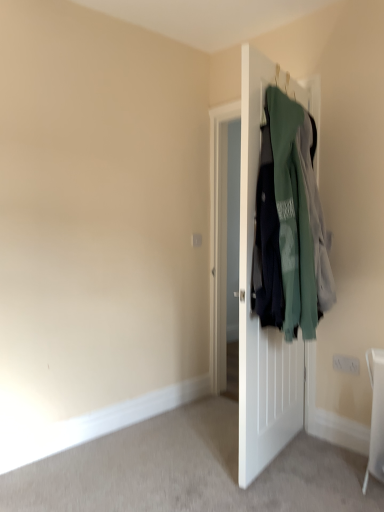
Question: Considering the relative positions of green fabric jackets at right and white matte door at center in the image provided, is green fabric jackets at right in front of white matte door at center?

Choices:
 (A) yes
 (B) no

Answer: (A)

Question: Is green fabric jackets at right facing away from white matte door at center?

Choices:
 (A) no
 (B) yes

Answer: (B)

Question: Does green fabric jackets at right have a lesser height compared to white matte door at center?

Choices:
 (A) no
 (B) yes

Answer: (B)

Question: Does green fabric jackets at right turn towards white matte door at center?

Choices:
 (A) no
 (B) yes

Answer: (B)

Question: Does green fabric jackets at right have a smaller size compared to white matte door at center?

Choices:
 (A) yes
 (B) no

Answer: (B)

Question: Is white matte door at center inside green fabric jackets at right?

Choices:
 (A) no
 (B) yes

Answer: (B)

Question: From a real-world perspective, is white matte door at center located higher than green fabric jackets at right?

Choices:
 (A) no
 (B) yes

Answer: (A)

Question: Are white matte door at center and green fabric jackets at right making contact?

Choices:
 (A) no
 (B) yes

Answer: (A)

Question: Would you consider white matte door at center to be distant from green fabric jackets at right?

Choices:
 (A) yes
 (B) no

Answer: (B)

Question: Does white matte door at center have a smaller size compared to green fabric jackets at right?

Choices:
 (A) no
 (B) yes

Answer: (B)

Question: Considering the relative sizes of white matte door at center and green fabric jackets at right in the image provided, is white matte door at center wider than green fabric jackets at right?

Choices:
 (A) yes
 (B) no

Answer: (B)

Question: Does white matte door at center have a larger size compared to green fabric jackets at right?

Choices:
 (A) yes
 (B) no

Answer: (B)

Question: In terms of height, does green fabric jackets at right look taller or shorter compared to white matte door at center?

Choices:
 (A) tall
 (B) short

Answer: (B)